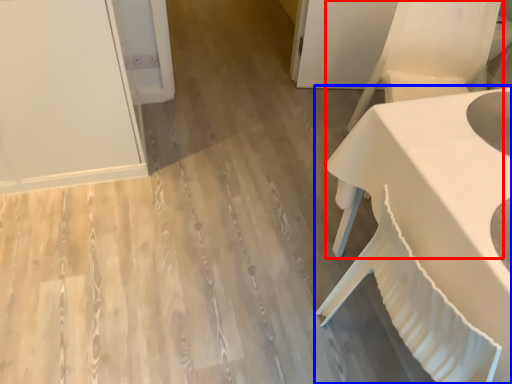
Question: Among these objects, which one is farthest to the camera, armchair (highlighted by a red box) or table (highlighted by a blue box)?

Choices:
 (A) armchair
 (B) table

Answer: (A)